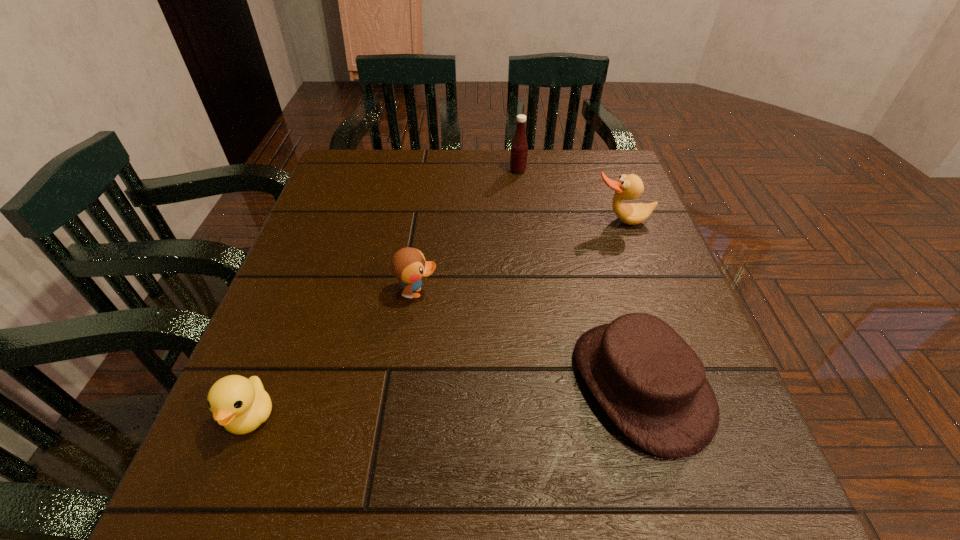
Locate an element on the screen. This screenshot has width=960, height=540. vacant space at the left edge of the desktop is located at coordinates (322, 293).

In the image, there is a desktop. At what (x,y) coordinates should I click in order to perform the action: click on vacant space at the right edge. Please return your answer as a coordinate pair (x, y). Looking at the image, I should click on (631, 230).

Where is `free space at the far left corner of the desktop`? Image resolution: width=960 pixels, height=540 pixels. free space at the far left corner of the desktop is located at coordinates (338, 154).

In order to click on free space at the far right corner of the desktop in this screenshot , I will do `click(588, 162)`.

What are the coordinates of `free space at the near right corner of the desktop` in the screenshot? It's located at (690, 470).

Identify the location of vacant space that's between the fourth nearest object and the third nearest object. The image size is (960, 540). [519, 257].

Where is `vacant space that's between the hat and the tallest object`? vacant space that's between the hat and the tallest object is located at coordinates (579, 277).

Image resolution: width=960 pixels, height=540 pixels. What are the coordinates of `vacant area between the Tabasco sauce and the rightmost duck` in the screenshot? It's located at (569, 196).

Where is `free space between the hat and the Tabasco sauce`? This screenshot has height=540, width=960. free space between the hat and the Tabasco sauce is located at coordinates pyautogui.click(x=579, y=277).

In order to click on free space between the second nearest duck and the farthest duck in this screenshot , I will do `click(519, 257)`.